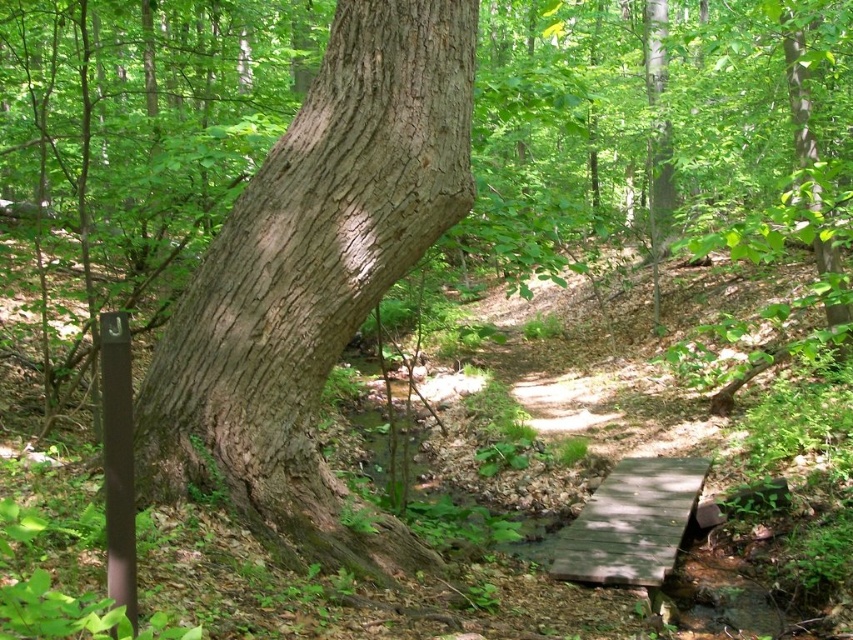
Question: Which object appears closest to the camera in this image?

Choices:
 (A) wooden bridge at center
 (B) brown rough bark tree trunk at center

Answer: (B)

Question: Is brown rough bark tree trunk at center thinner than wooden bridge at center?

Choices:
 (A) yes
 (B) no

Answer: (A)

Question: Does brown rough bark tree trunk at center come behind wooden bridge at center?

Choices:
 (A) yes
 (B) no

Answer: (B)

Question: Does brown rough bark tree trunk at center have a lesser width compared to wooden bridge at center?

Choices:
 (A) no
 (B) yes

Answer: (B)

Question: Which point is farther to the camera?

Choices:
 (A) (239, 419)
 (B) (618, 483)

Answer: (B)

Question: Which object appears farthest from the camera in this image?

Choices:
 (A) wooden bridge at center
 (B) brown rough bark tree trunk at center

Answer: (A)